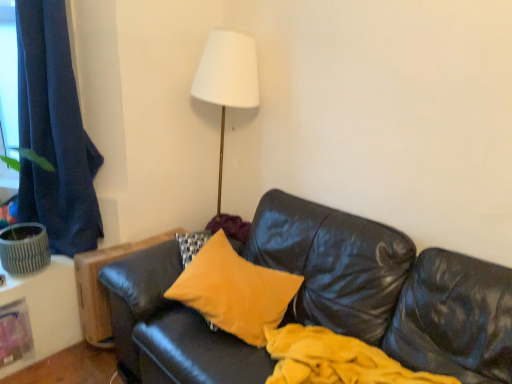
Question: Does dark blue fabric curtain at left have a lesser width compared to velvet yellow pillow at center?

Choices:
 (A) yes
 (B) no

Answer: (A)

Question: Is dark blue fabric curtain at left facing away from velvet yellow pillow at center?

Choices:
 (A) yes
 (B) no

Answer: (B)

Question: Does dark blue fabric curtain at left appear on the left side of velvet yellow pillow at center?

Choices:
 (A) no
 (B) yes

Answer: (B)

Question: Does dark blue fabric curtain at left have a lesser height compared to velvet yellow pillow at center?

Choices:
 (A) no
 (B) yes

Answer: (A)

Question: Is dark blue fabric curtain at left completely or partially outside of velvet yellow pillow at center?

Choices:
 (A) no
 (B) yes

Answer: (B)

Question: From the image's perspective, is dark blue fabric curtain at left located beneath velvet yellow pillow at center?

Choices:
 (A) yes
 (B) no

Answer: (B)

Question: Is velvet yellow pillow at center outside of dark blue fabric curtain at left?

Choices:
 (A) yes
 (B) no

Answer: (A)

Question: Is velvet yellow pillow at center not close to dark blue fabric curtain at left?

Choices:
 (A) no
 (B) yes

Answer: (A)

Question: Does velvet yellow pillow at center have a smaller size compared to dark blue fabric curtain at left?

Choices:
 (A) yes
 (B) no

Answer: (A)

Question: From the image's perspective, would you say velvet yellow pillow at center is positioned over dark blue fabric curtain at left?

Choices:
 (A) no
 (B) yes

Answer: (A)

Question: Is velvet yellow pillow at center at the left side of dark blue fabric curtain at left?

Choices:
 (A) yes
 (B) no

Answer: (B)

Question: Does velvet yellow pillow at center lie in front of dark blue fabric curtain at left?

Choices:
 (A) yes
 (B) no

Answer: (A)

Question: From a real-world perspective, relative to velvet yellow pillow at center, is dark blue fabric curtain at left vertically above or below?

Choices:
 (A) below
 (B) above

Answer: (B)